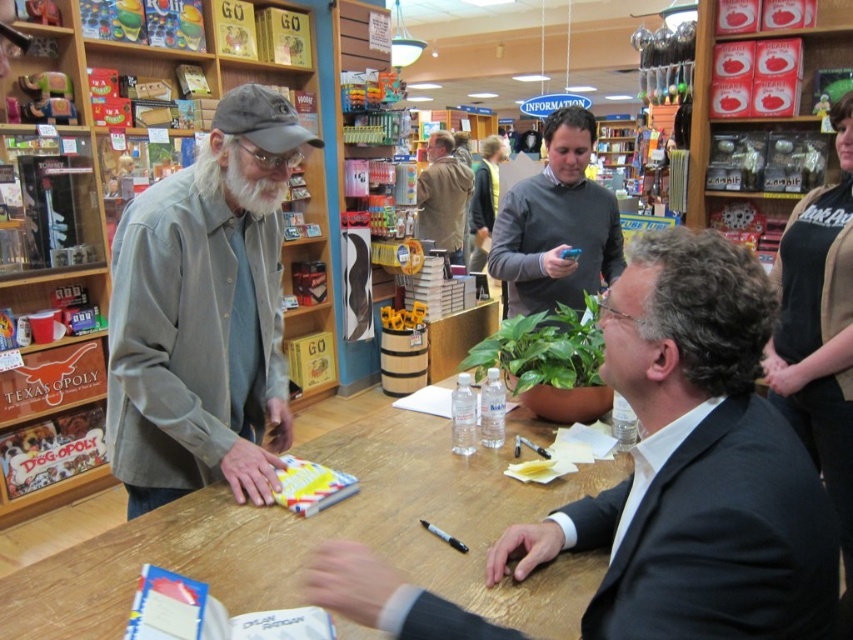
Question: In this image, where is wooden table at center located relative to gray cotton shirt at left?

Choices:
 (A) below
 (B) above

Answer: (A)

Question: Which point is farther from the camera taking this photo?

Choices:
 (A) (480, 168)
 (B) (419, 234)

Answer: (A)

Question: Does black cotton shirt at upper right have a smaller size compared to dark gray sweater at center?

Choices:
 (A) no
 (B) yes

Answer: (B)

Question: Among these points, which one is farthest from the camera?

Choices:
 (A) (454, 173)
 (B) (663, 468)

Answer: (A)

Question: Can you confirm if dark gray suit at center is bigger than gray cotton shirt at left?

Choices:
 (A) yes
 (B) no

Answer: (B)

Question: Which of the following is the farthest from the observer?

Choices:
 (A) (485, 256)
 (B) (222, 244)
 (C) (373, 618)
 (D) (454, 200)

Answer: (A)